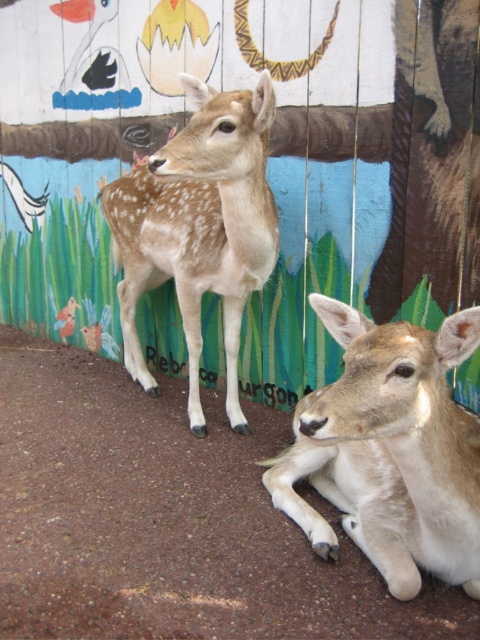
Can you confirm if light brown fur at center is positioned above spotted fur deer at center?

Incorrect, light brown fur at center is not positioned above spotted fur deer at center.

Who is more forward, [464,483] or [240,90]?

Point [464,483] is in front.

This screenshot has height=640, width=480. I want to click on light brown fur at center, so click(389, 451).